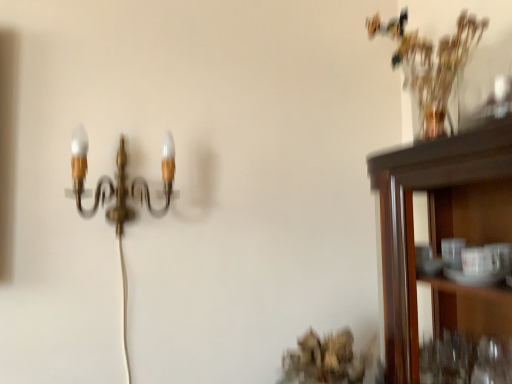
Question: Is gold metallic wall sconce at upper left taller or shorter than translucent glass vase at upper right?

Choices:
 (A) short
 (B) tall

Answer: (B)

Question: Considering the positions of point (120, 183) and point (428, 115), is point (120, 183) closer or farther from the camera than point (428, 115)?

Choices:
 (A) closer
 (B) farther

Answer: (B)

Question: Is gold metallic wall sconce at upper left wider or thinner than translucent glass vase at upper right?

Choices:
 (A) wide
 (B) thin

Answer: (A)

Question: Is point (440, 120) closer or farther from the camera than point (131, 188)?

Choices:
 (A) farther
 (B) closer

Answer: (B)

Question: In the image, is translucent glass vase at upper right positioned in front of or behind gold metallic wall sconce at upper left?

Choices:
 (A) behind
 (B) front

Answer: (B)

Question: From their relative heights in the image, would you say translucent glass vase at upper right is taller or shorter than gold metallic wall sconce at upper left?

Choices:
 (A) short
 (B) tall

Answer: (A)

Question: Looking at their shapes, would you say translucent glass vase at upper right is wider or thinner than gold metallic wall sconce at upper left?

Choices:
 (A) wide
 (B) thin

Answer: (B)